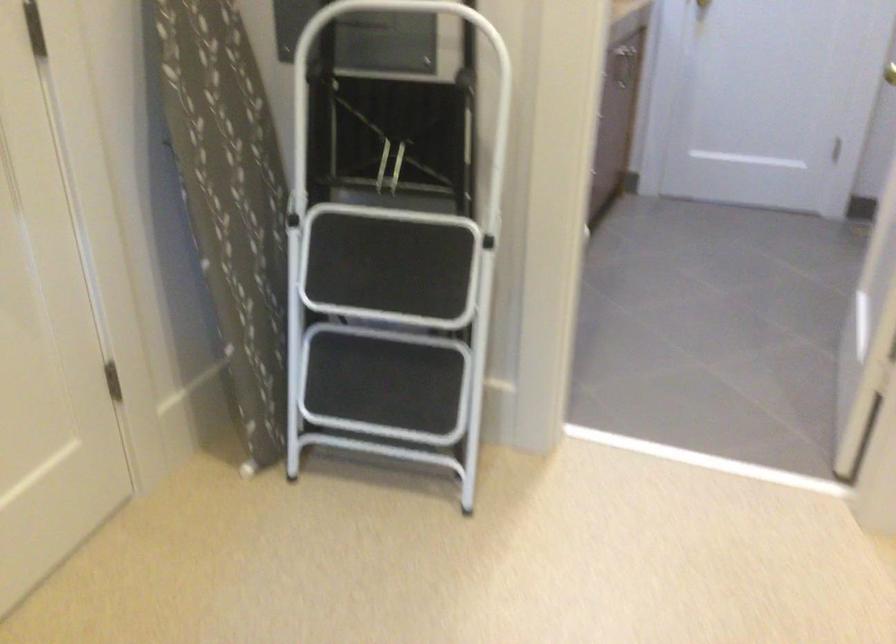
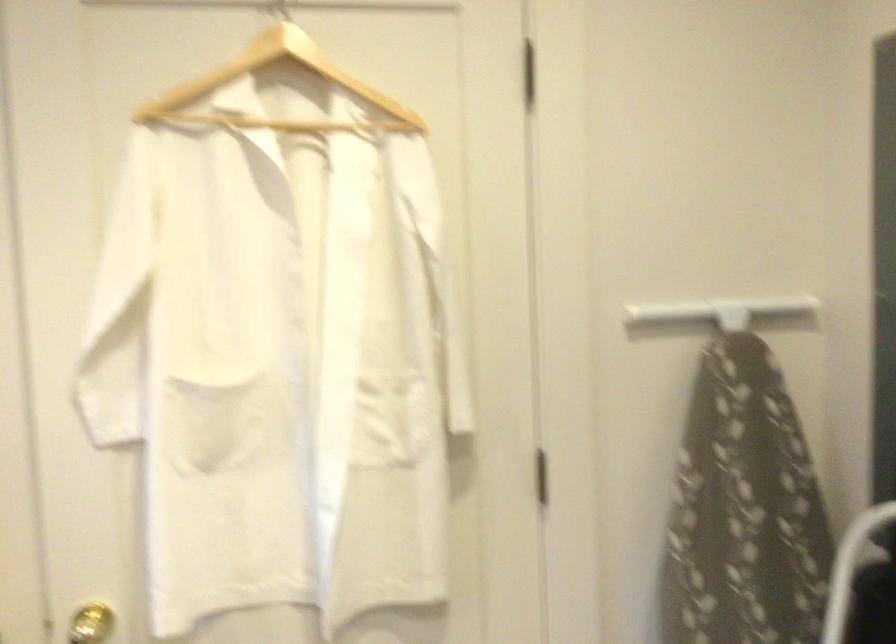
Question: The camera is either moving clockwise (left) or counter-clockwise (right) around the object. The first image is from the beginning of the video and the second image is from the end. Is the camera moving left or right when shooting the video?

Choices:
 (A) Left
 (B) Right

Answer: (B)